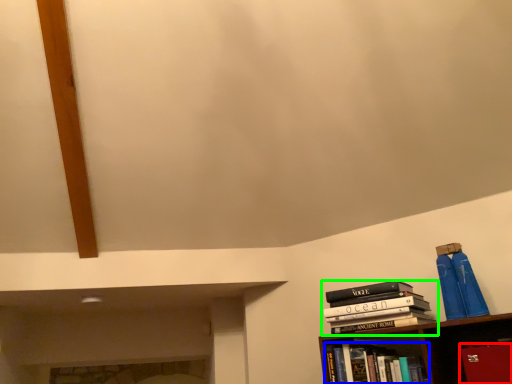
Question: Based on their relative distances, which object is nearer to paperback book (highlighted by a red box)? Choose from book (highlighted by a blue box) and book (highlighted by a green box).

Choices:
 (A) book
 (B) book

Answer: (B)